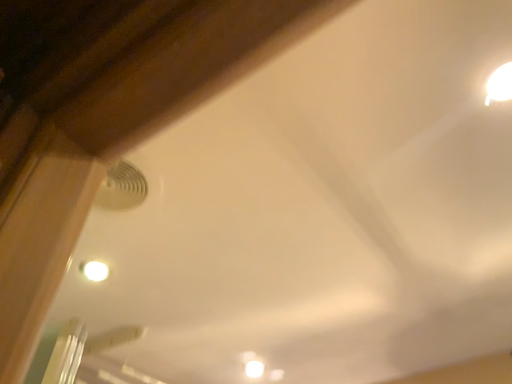
This screenshot has height=384, width=512. Describe the element at coordinates (499, 84) in the screenshot. I see `white glossy lamp at upper right` at that location.

The width and height of the screenshot is (512, 384). I want to click on white glossy lamp at upper right, so click(499, 84).

Where is `white glossy lamp at upper right`? white glossy lamp at upper right is located at coordinates (499, 84).